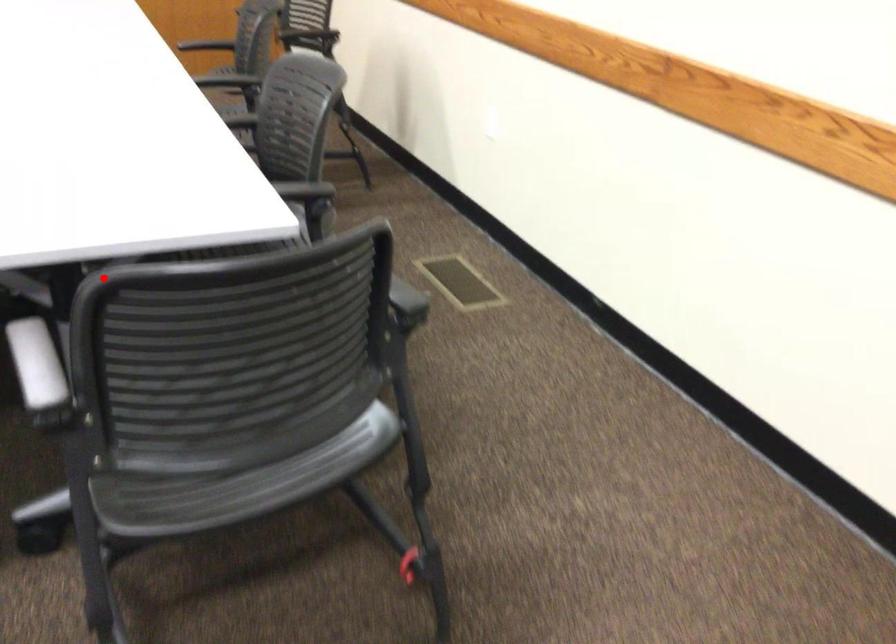
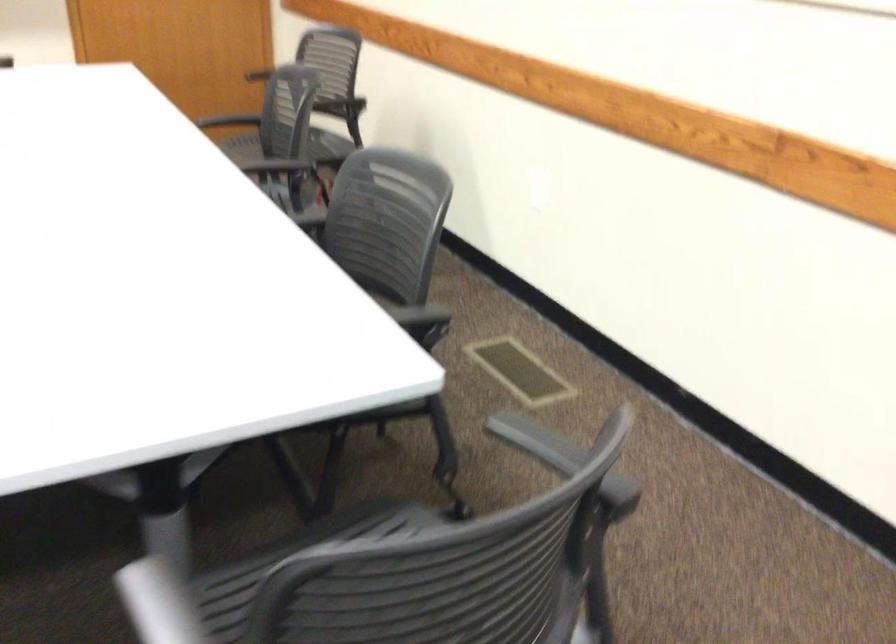
Question: A red point is marked in image1. In image2, is the corresponding 3D point closer to the camera or farther? Reply with the corresponding letter.

Choices:
 (A) The corresponding 3D point is closer.
 (B) The corresponding 3D point is farther.

Answer: (A)